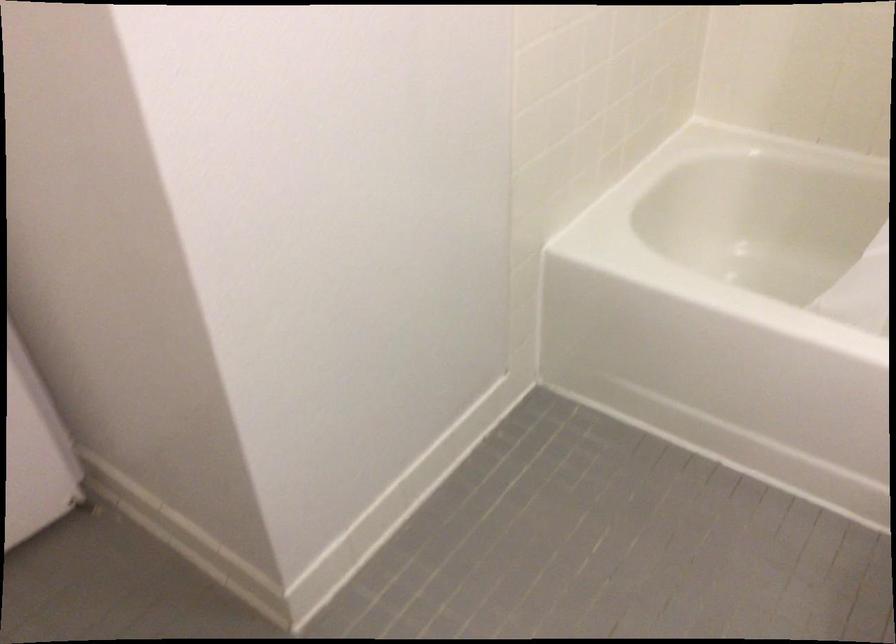
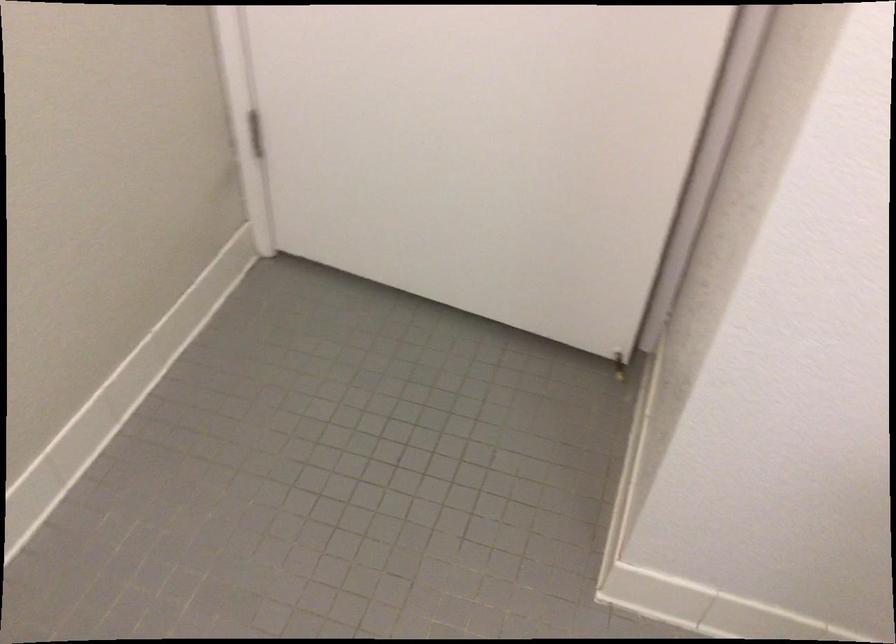
The first image is from the beginning of the video and the second image is from the end. How did the camera likely rotate when shooting the video?

The camera rotated toward left-down.